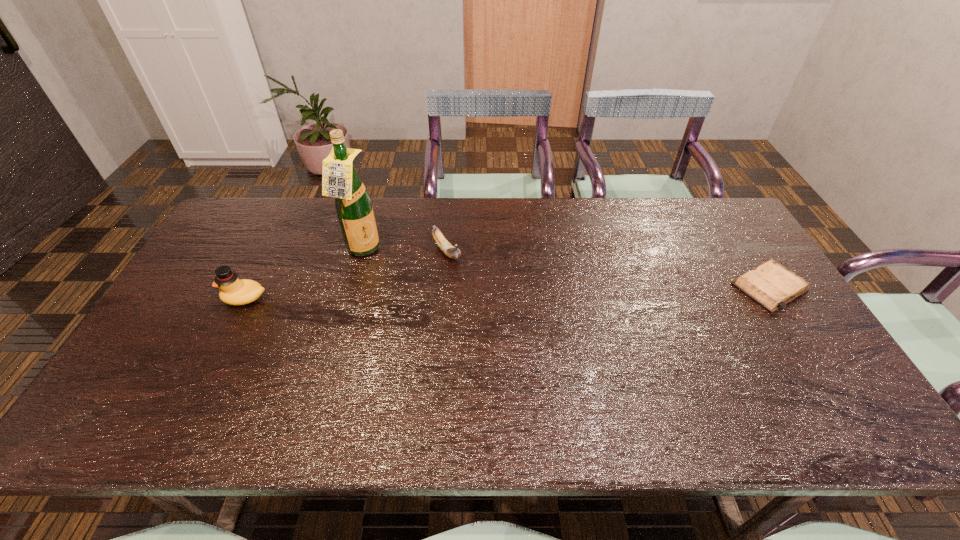
Locate an element on the screen. Image resolution: width=960 pixels, height=540 pixels. vacant space on the desktop that is between the duck and the shortest object and is positioned at the stem of the second object from right to left is located at coordinates (480, 293).

Identify the location of vacant spot on the desktop that is between the leftmost object and the diary and is positioned on the front-facing side of the second object from left to right. This screenshot has height=540, width=960. (455, 294).